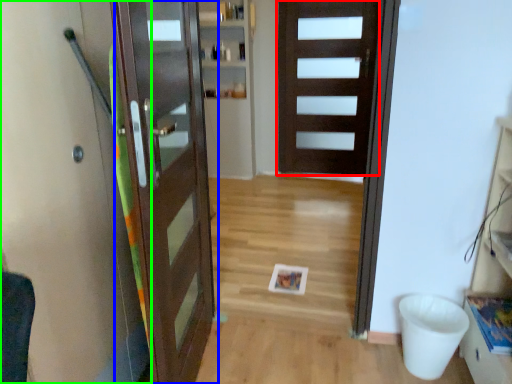
Question: Which is nearer to the door (highlighted by a red box)? door (highlighted by a blue box) or elevator (highlighted by a green box).

Choices:
 (A) door
 (B) elevator

Answer: (A)